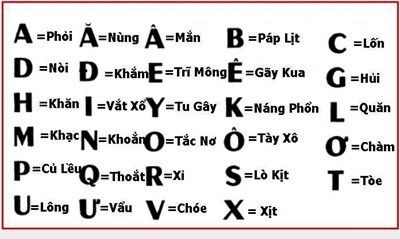
At what (x,y) coordinates should I click in order to perform the action: click on red frame. Please return your answer as a coordinate pair (x, y). The width and height of the screenshot is (400, 239). Looking at the image, I should click on (252, 228).